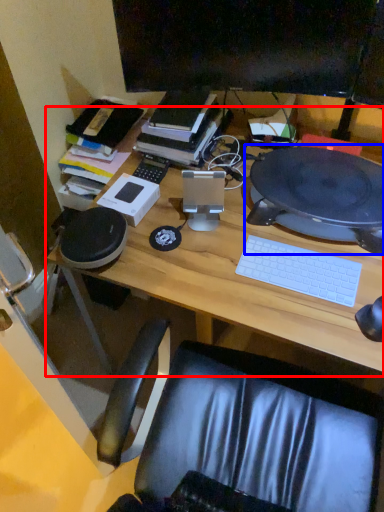
Question: Which of the following is the farthest to the observer, desk (highlighted by a red box) or computer (highlighted by a blue box)?

Choices:
 (A) desk
 (B) computer

Answer: (B)